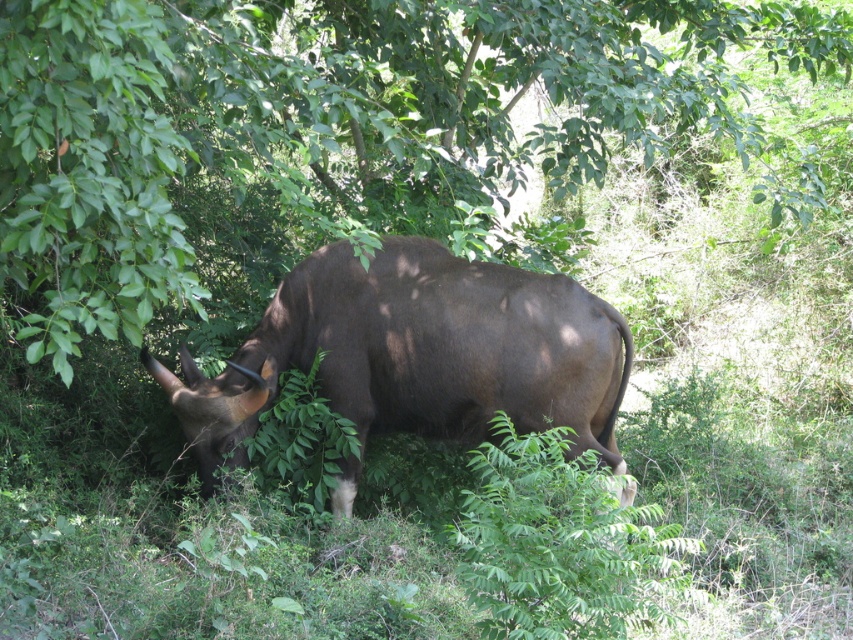
Which is behind, point (570, 22) or point (263, 352)?

The point (570, 22) is more distant.

Is point (689, 56) positioned in front of point (242, 362)?

No.

Image resolution: width=853 pixels, height=640 pixels. I want to click on green leafy tree at center, so click(331, 122).